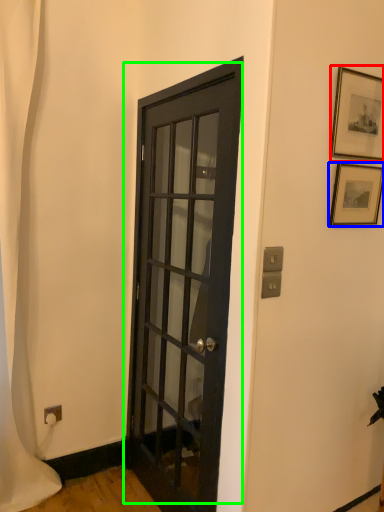
Question: Which is farther away from picture frame (highlighted by a red box)? picture frame (highlighted by a blue box) or door (highlighted by a green box)?

Choices:
 (A) picture frame
 (B) door

Answer: (B)